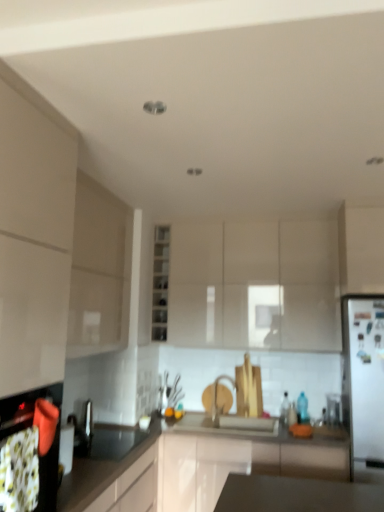
Question: Is point (33, 275) closer or farther from the camera than point (182, 240)?

Choices:
 (A) closer
 (B) farther

Answer: (A)

Question: From their relative heights in the image, would you say white glossy cabinet at left, placed as the fifth cabinetry when sorted from right to left, is taller or shorter than matte white cabinet at center, the 4th cabinetry when ordered from left to right?

Choices:
 (A) tall
 (B) short

Answer: (A)

Question: Considering the real-world distances, which object is farthest from the white glossy cabinet at left, which is the first cabinetry in left-to-right order?

Choices:
 (A) matte black oven at lower left
 (B) clear glass shelves at center, arranged as the third cabinetry when viewed from the left
 (C) silver metallic faucet at center
 (D) matte white cabinet at center, the 4th cabinetry when ordered from left to right
 (E) black glossy countertop at lower left

Answer: (C)

Question: Based on their relative distances, which object is nearer to the white glossy refrigerator at right?

Choices:
 (A) silver metallic faucet at center
 (B) black glossy countertop at lower left
 (C) white glossy cabinet at right, which is the first cabinetry in right-to-left order
 (D) clear glass shelves at center, acting as the 3th cabinetry starting from the right
 (E) white glossy cabinet at left, which is the first cabinetry in left-to-right order

Answer: (C)